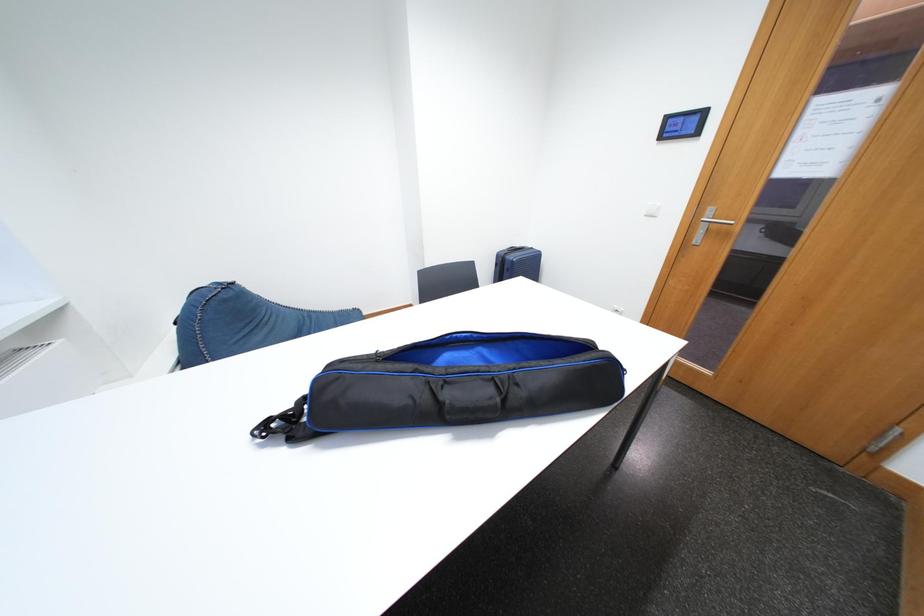
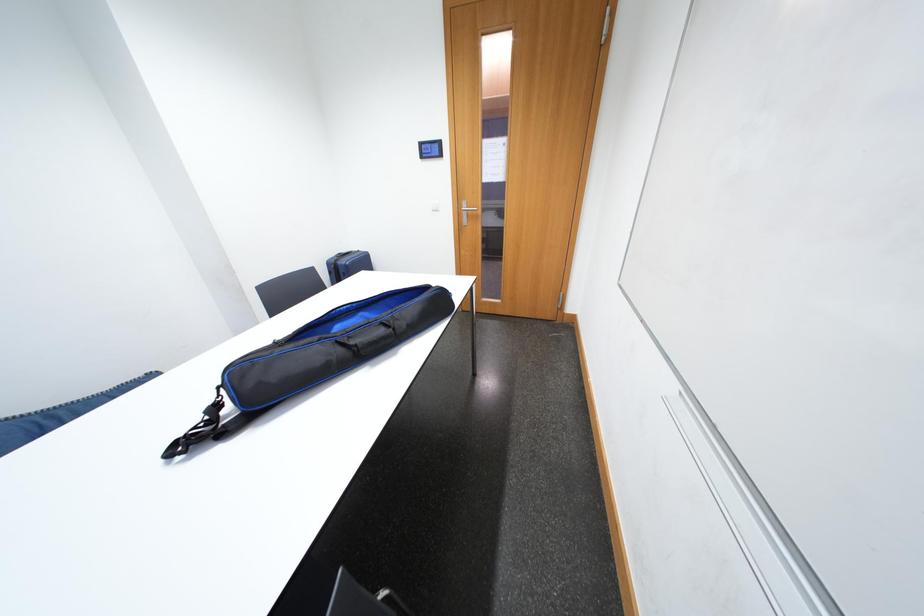
Question: The first image is from the beginning of the video and the second image is from the end. How did the camera likely rotate when shooting the video?

Choices:
 (A) Left
 (B) Right
 (C) Up
 (D) Down

Answer: (B)